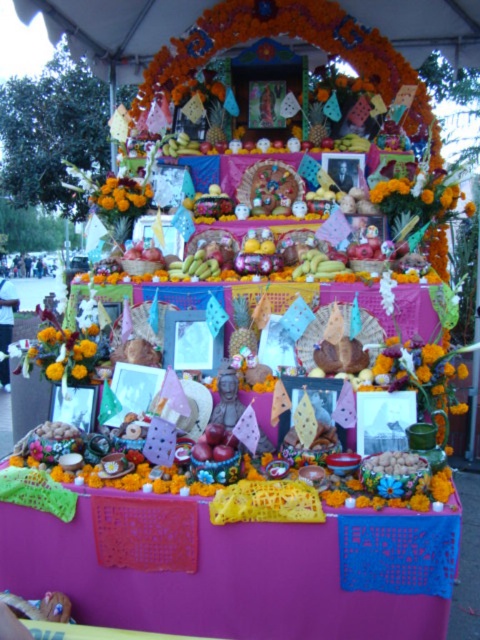
What do you see at coordinates (418, 195) in the screenshot?
I see `orange marigold at upper right` at bounding box center [418, 195].

Does orange marigold at upper right appear on the left side of orange matte flower at center?

No, orange marigold at upper right is not to the left of orange matte flower at center.

Identify the location of orange marigold at upper right. Image resolution: width=480 pixels, height=640 pixels. (418, 195).

Does orange matte flower at center appear on the right side of matte white woman at lower left?

Correct, you'll find orange matte flower at center to the right of matte white woman at lower left.

Which of these two, orange matte flower at center or matte white woman at lower left, stands shorter?

orange matte flower at center is shorter.

Is point (147, 188) farther from viewer compared to point (8, 324)?

No, (147, 188) is in front of (8, 324).

Find the location of `orange matte flower at center`. orange matte flower at center is located at coordinates (121, 196).

Based on the photo, between purple fabric table at center and orange fabric at lower left, which one is positioned higher?

Positioned higher is orange fabric at lower left.

Between point (327, 609) and point (55, 376), which one is positioned behind?

Positioned behind is point (55, 376).

The height and width of the screenshot is (640, 480). What are the coordinates of `purple fabric table at center` in the screenshot? It's located at (250, 573).